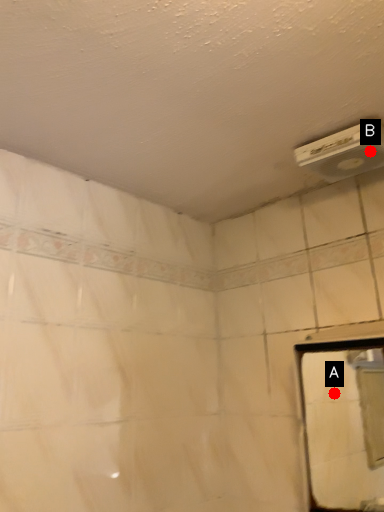
Question: Two points are circled on the image, labeled by A and B beside each circle. Which point appears farthest from the camera in this image?

Choices:
 (A) A is further
 (B) B is further

Answer: (A)